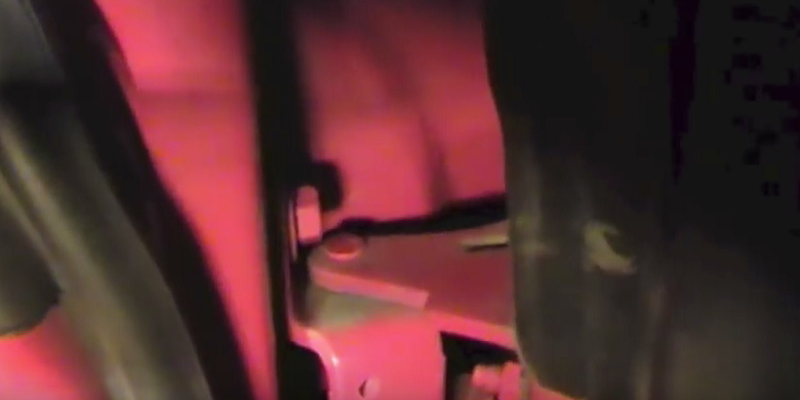
Where is `washer`? washer is located at coordinates (292, 243).